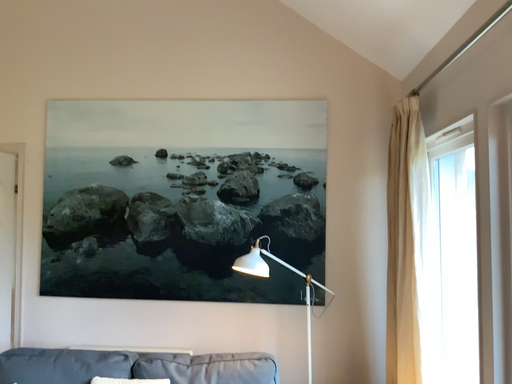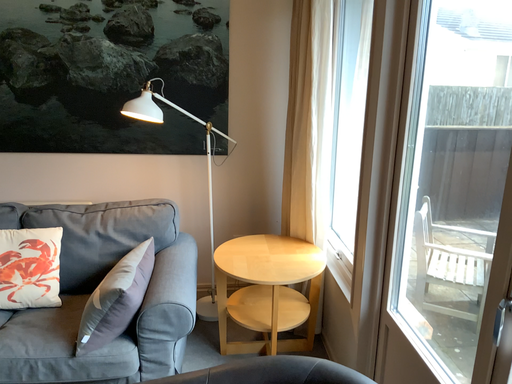
Question: Which way did the camera rotate in the video?

Choices:
 (A) rotated right
 (B) rotated left

Answer: (A)